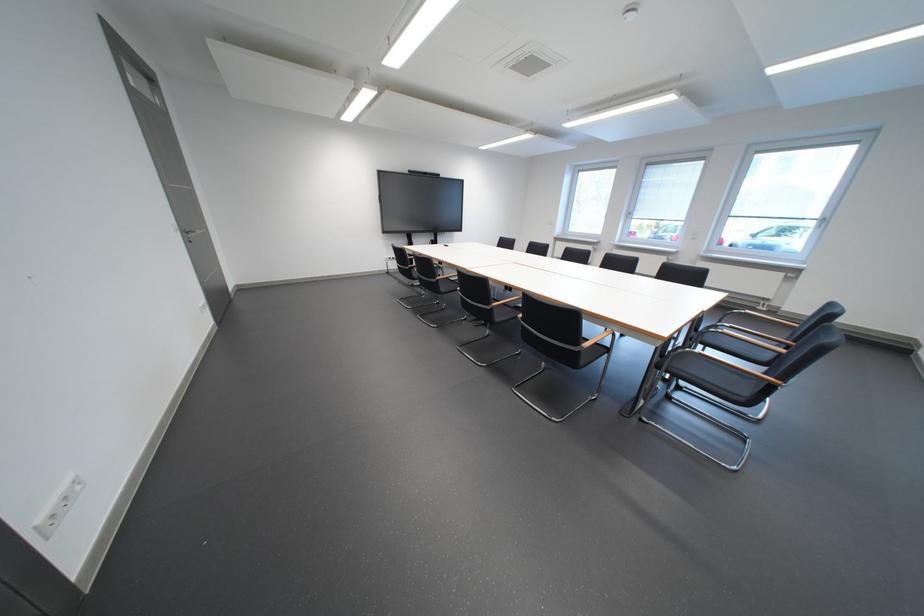
Find where to push the silver door handle. Please return your answer as a coordinate pair (x, y).

(190, 233)